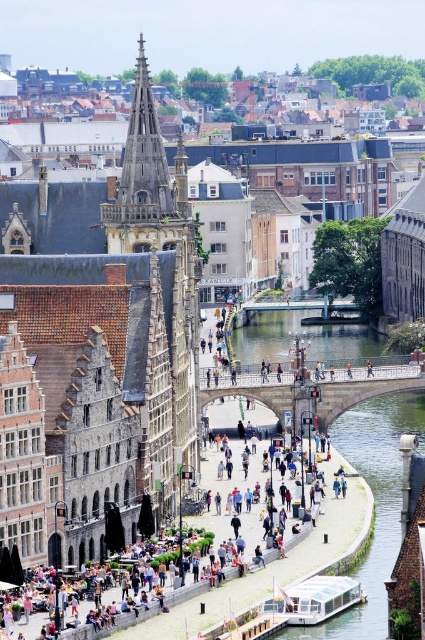
You are a tourist standing on the bridge and want to take a photo of the clear water at bridge center and the matte brown building at center. Which object should you focus on first if you want to capture both in one shot without moving the camera?

You should focus on the clear water at bridge center first because it is taller than the matte brown building at center, so adjusting the focus to the taller object ensures both are in the frame.

You are a tourist standing on the bridge and want to take a photo of both the clear water at bridge center and the matte brown building at center. Which object should you adjust your camera to focus on first if you want to capture both in the same frame?

You should focus on the matte brown building at center first because the clear water at bridge center is positioned on the right side of it, ensuring both are within the frame when centered on the building.

You are a tourist visiting this canal town and want to take a photo that includes both the clear water at bridge center and the matte brown building at center. Which object should you position closer to the edge of your camera frame to ensure both fit in the shot?

Since the clear water at bridge center is thinner than the matte brown building at center, you should position the matte brown building at center closer to the edge of your camera frame to ensure both fit in the shot.